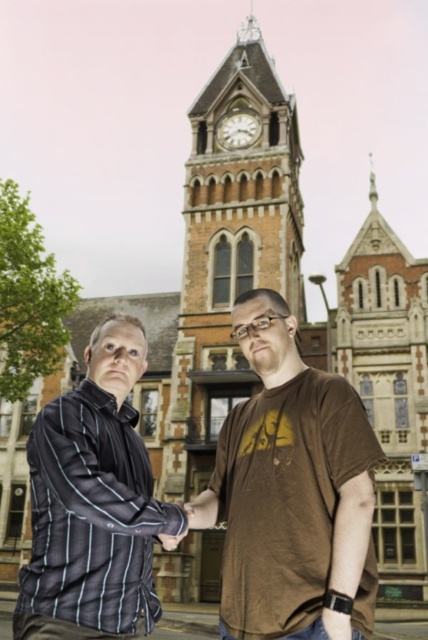
Does point (341, 429) lie in front of point (30, 492)?

Yes.

Is brown cotton t-shirt at center smaller than black pinstripe shirt at left?

No.

This screenshot has width=428, height=640. Find the location of `brown cotton t-shirt at center`. brown cotton t-shirt at center is located at coordinates (291, 492).

This screenshot has height=640, width=428. I want to click on brown cotton t-shirt at center, so tap(291, 492).